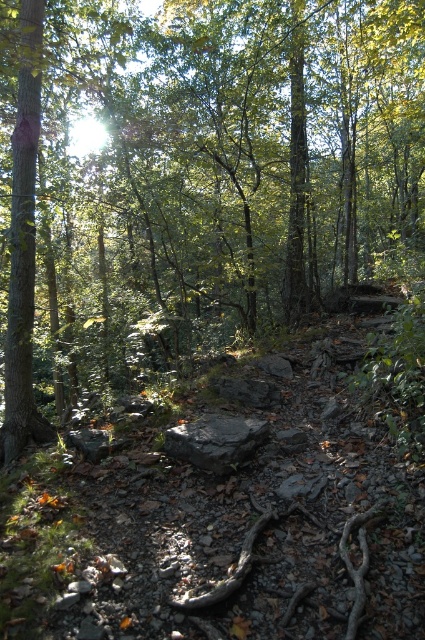
Question: Is green leafy tree at center to the right of black rock at center from the viewer's perspective?

Choices:
 (A) yes
 (B) no

Answer: (B)

Question: Which object appears closest to the camera in this image?

Choices:
 (A) black rock at center
 (B) green leafy tree at center

Answer: (A)

Question: Is green leafy tree at center above black rock at center?

Choices:
 (A) yes
 (B) no

Answer: (A)

Question: Which object appears farthest from the camera in this image?

Choices:
 (A) green leafy tree at center
 (B) black rock at center

Answer: (A)

Question: Considering the relative positions of green leafy tree at center and black rock at center in the image provided, where is green leafy tree at center located with respect to black rock at center?

Choices:
 (A) below
 (B) above

Answer: (B)